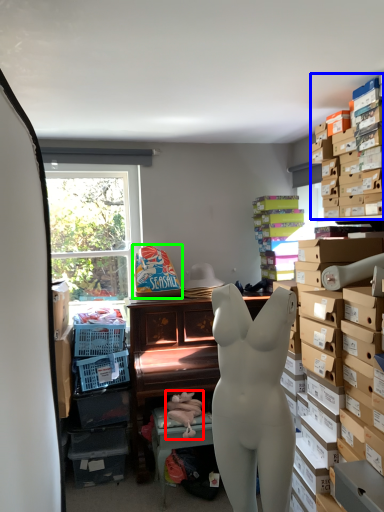
Question: Considering the real-world distances, which object is closest to toy (highlighted by a red box)? shelf (highlighted by a blue box) or toy (highlighted by a green box).

Choices:
 (A) shelf
 (B) toy

Answer: (B)